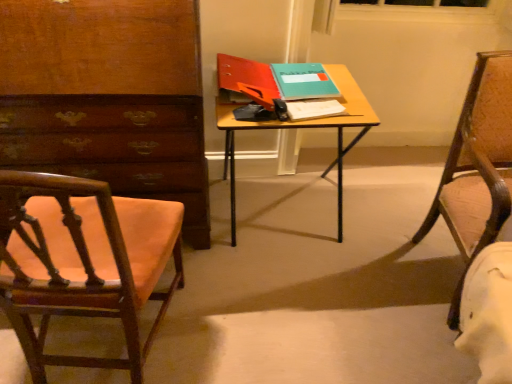
You are a GUI agent. You are given a task and a screenshot of the screen. Output one action in this format:
    pyautogui.click(x=<x>, y=<y>)
    Task: Click on the vacant space that's between leather-like brown chair at right, which is the second chair from left to right, and wooden desk at center
    
    Given the screenshot: What is the action you would take?
    pyautogui.click(x=361, y=258)